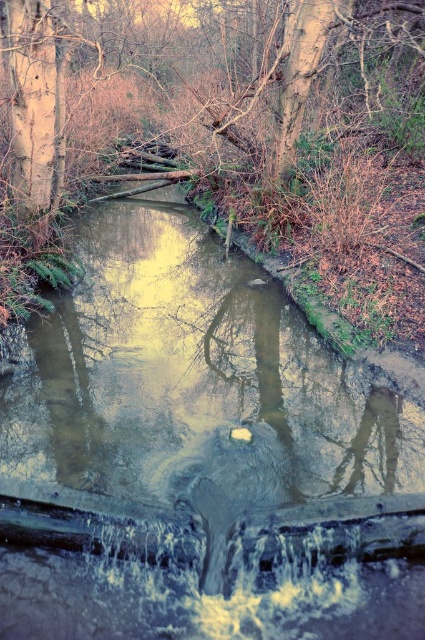
Question: Does brown concrete at center have a lesser width compared to brown wood tree at upper center?

Choices:
 (A) no
 (B) yes

Answer: (B)

Question: Among these points, which one is farthest from the camera?

Choices:
 (A) (99, 276)
 (B) (33, 16)

Answer: (A)

Question: Which point is closer to the camera taking this photo?

Choices:
 (A) pyautogui.click(x=56, y=317)
 (B) pyautogui.click(x=39, y=32)

Answer: (B)

Question: Is brown concrete at center thinner than brown wood tree at upper center?

Choices:
 (A) yes
 (B) no

Answer: (A)

Question: Is brown concrete at center below brown wood tree at upper center?

Choices:
 (A) yes
 (B) no

Answer: (A)

Question: Among these objects, which one is farthest from the camera?

Choices:
 (A) brown wood tree at upper center
 (B) brown concrete at center

Answer: (A)